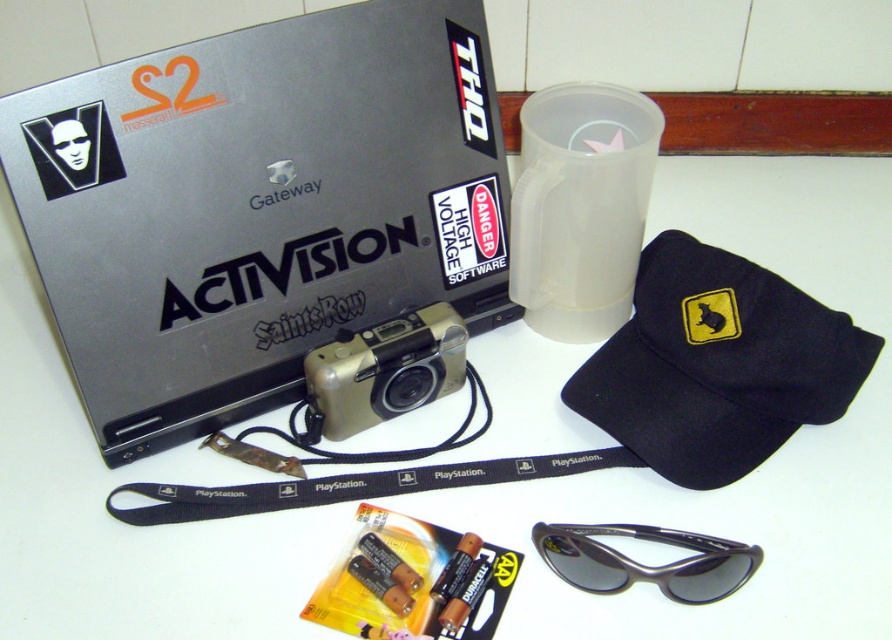
You are looking at the image and want to determine which of the two points, point (160, 500) or point (560, 531), is closer to you. Based on the spatial arrangement, which point is nearer?

Point (160, 500) is further to the viewer than point (560, 531). Wait, no, the description says the first point is further to the viewer, so the second point is closer. Hmm, need to clarify. The question asks which is closer to you. Since point A is further to the viewer, meaning it is closer to the observer, while point B is further away. Wait, the description says point A is further to the viewer than point B. So point A is closer to the viewer, so the answer is point A is closer. Therefore, the first

What is the exact coordinate of the black fabric lanyard at center?

The black fabric lanyard at center is located at coordinate point (351, 484).

You are organizing items on a table and need to move the metallic silver camera at center and the black fabric lanyard at center. Which item is closer to you when looking from the front of the table?

The metallic silver camera at center is closer to you because the black fabric lanyard at center is behind it.